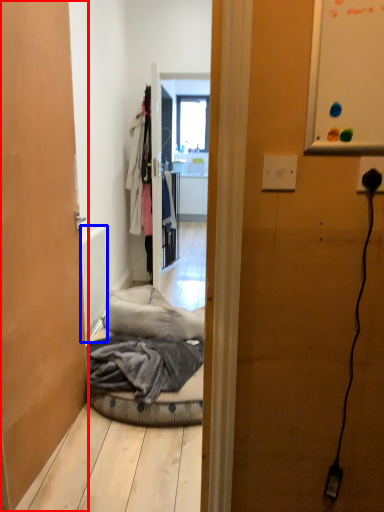
Question: Which point is further to the camera, door (highlighted by a red box) or radiator (highlighted by a blue box)?

Choices:
 (A) door
 (B) radiator

Answer: (B)